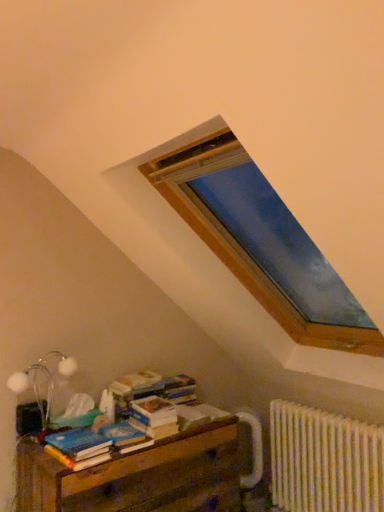
Locate an element on the screen. This screenshot has height=512, width=384. free spot above blue matte paperback book at lower left, which ranks as the 2th paperback book in right-to-left order (from a real-world perspective) is located at coordinates (116, 425).